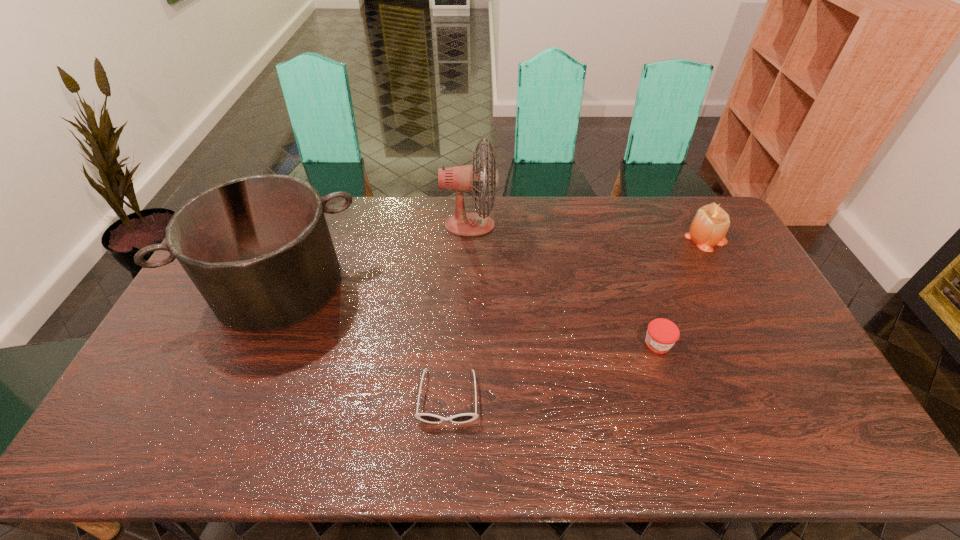
Where is `free space that satisfies the following two spatial constraints: 1. in front of the fan to direct airflow; 2. on the front side of the pan`? free space that satisfies the following two spatial constraints: 1. in front of the fan to direct airflow; 2. on the front side of the pan is located at coordinates (468, 285).